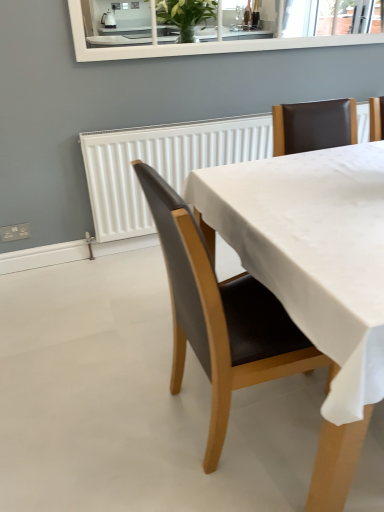
Locate an element on the screen. The height and width of the screenshot is (512, 384). vacant region to the left of brown leather chair at center is located at coordinates (118, 417).